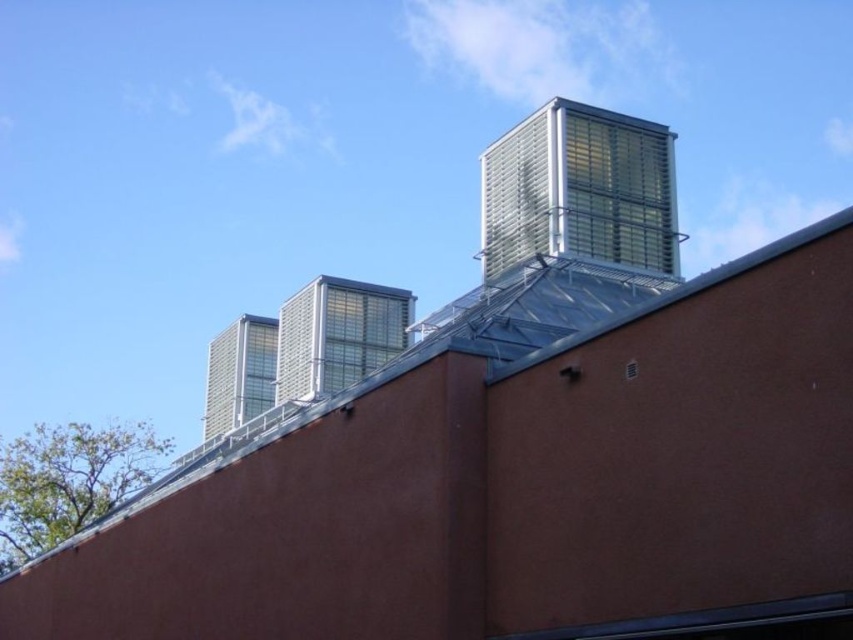
You are a maintenance worker needing to inspect both the metallic grid tower at upper right and the metallic grid structure at center. Which one requires a taller ladder to reach the top?

The metallic grid tower at upper right requires a taller ladder since it is much taller than the metallic grid structure at center.

You are standing on the roof of the building shown in the image. There is a point marked at coordinates (579, 189). What object is located at that point?

The point at coordinates (579, 189) indicates the location of the metallic grid tower at upper right.